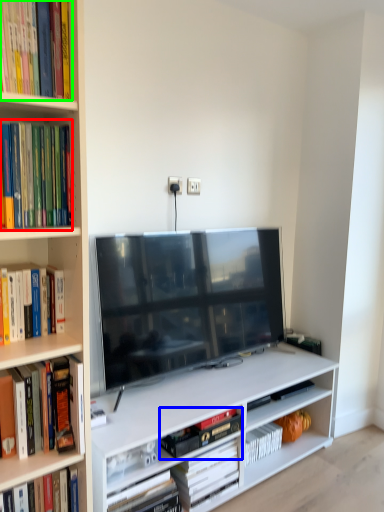
Question: Considering the real-world distances, which object is farthest from book (highlighted by a red box)? book (highlighted by a blue box) or book (highlighted by a green box)?

Choices:
 (A) book
 (B) book

Answer: (A)